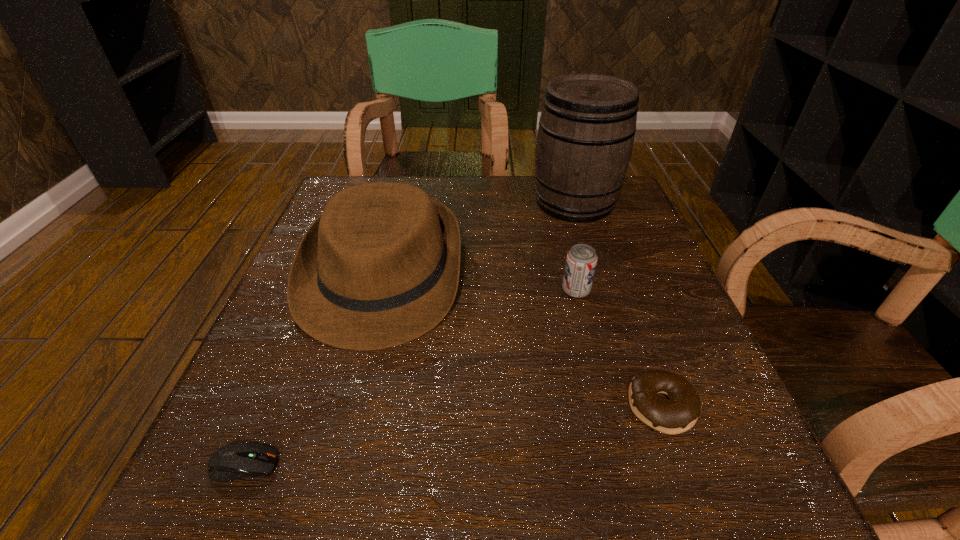
The image size is (960, 540). What are the coordinates of `object at the far left corner` in the screenshot? It's located at (380, 267).

This screenshot has width=960, height=540. Identify the location of object situated at the near left corner. (234, 461).

Find the location of `object at the far right corner`. object at the far right corner is located at coordinates (585, 138).

What are the coordinates of `vacant space at the far edge` in the screenshot? It's located at (476, 214).

In the image, there is a desktop. Where is `vacant area at the left edge`? The image size is (960, 540). vacant area at the left edge is located at coordinates (281, 446).

Where is `vacant region at the right edge of the desktop`? Image resolution: width=960 pixels, height=540 pixels. vacant region at the right edge of the desktop is located at coordinates (751, 441).

Find the location of a particular element. This screenshot has width=960, height=540. free space at the far right corner of the desktop is located at coordinates (637, 209).

The width and height of the screenshot is (960, 540). I want to click on free space at the near right corner of the desktop, so tap(758, 453).

Where is `unoccupied position between the tallest object and the fedora`? unoccupied position between the tallest object and the fedora is located at coordinates (479, 239).

At what (x,y) coordinates should I click in order to perform the action: click on vacant area that lies between the fourth farthest object and the second tallest object. Please return your answer as a coordinate pair (x, y). The width and height of the screenshot is (960, 540). Looking at the image, I should click on (522, 341).